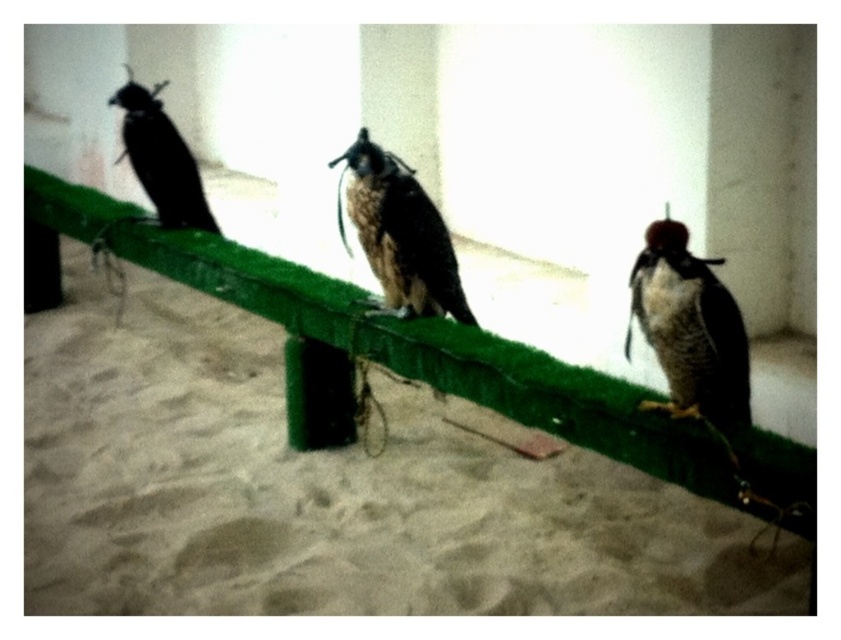
You are a birdwatcher trying to identify the birds in the image. You notice two birds with distinct features. The first is a black matte falcon at left, and the second has dark brown feathers at right. Which bird is wider?

The black matte falcon at left is wider than the dark brown feathers at right.